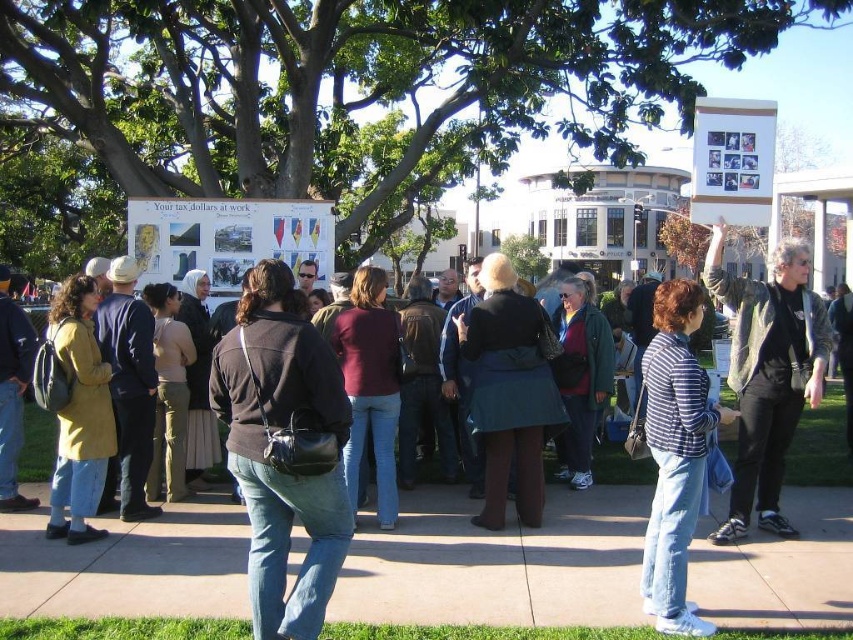
Question: Which point is farther to the camera?

Choices:
 (A) (692, 474)
 (B) (265, 305)
 (C) (734, 349)

Answer: (C)

Question: Can you confirm if dark brown leather jacket at center is positioned to the left of gray leather jacket at center?

Choices:
 (A) yes
 (B) no

Answer: (A)

Question: Estimate the real-world distances between objects in this image. Which object is closer to the striped cotton shirt at center?

Choices:
 (A) dark brown leather jacket at center
 (B) gray leather jacket at center

Answer: (B)

Question: Can you confirm if dark brown leather jacket at center is positioned below striped cotton shirt at center?

Choices:
 (A) no
 (B) yes

Answer: (A)

Question: Is dark brown leather jacket at center closer to the viewer compared to striped cotton shirt at center?

Choices:
 (A) yes
 (B) no

Answer: (A)

Question: Among these points, which one is farthest from the camera?

Choices:
 (A) (657, 584)
 (B) (788, 346)

Answer: (B)